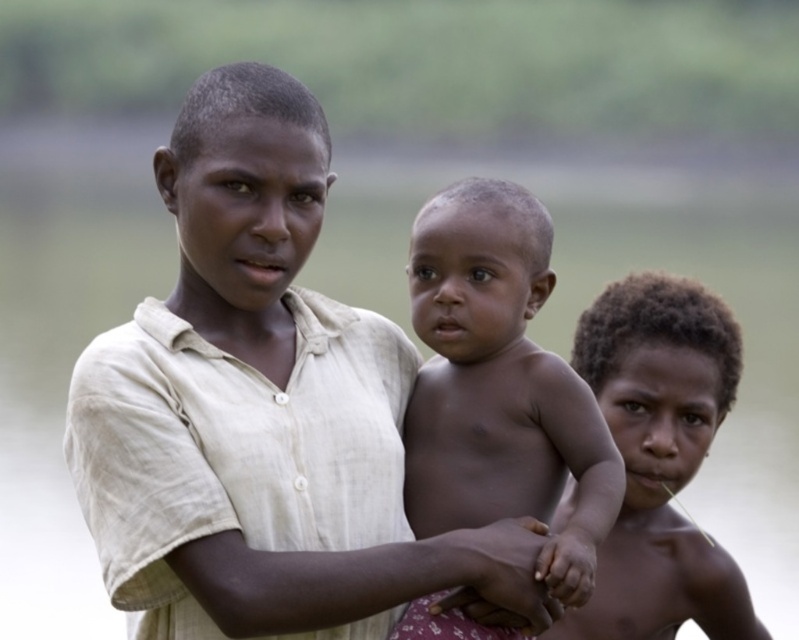
You are a photographer standing at the camera position. You want to take a closeup photo of the smooth skin baby at center. The camera has a maximum zoom range of 10 meters. Can you zoom in enough to capture the baby clearly?

The smooth skin baby at center is 7.95 meters away from the camera. Since the camera can zoom up to 10 meters, it can capture the baby clearly within the maximum zoom range.

You are a photographer who needs to capture a closeup shot of both the smooth skin baby at center and the dark brown skin at center. Given that your camera has a maximum focus range of 10 feet, will you be able to capture both subjects in focus without moving the camera or the subjects?

The smooth skin baby at center and the dark brown skin at center are 13.45 feet apart from each other, which exceeds the camera maximum focus range of 10 feet. Therefore, you cannot capture both subjects in focus without adjusting the camera or moving the subjects.

You are a photographer trying to capture a closeup of the smooth skin baby at center. The smooth skin hand at center is blocking part of the baby. Can you adjust your position to avoid the hand?

The smooth skin baby at center is positioned over the smooth skin hand at center, so moving the camera slightly upward or to the side might allow you to capture the baby without the hand blocking the view.